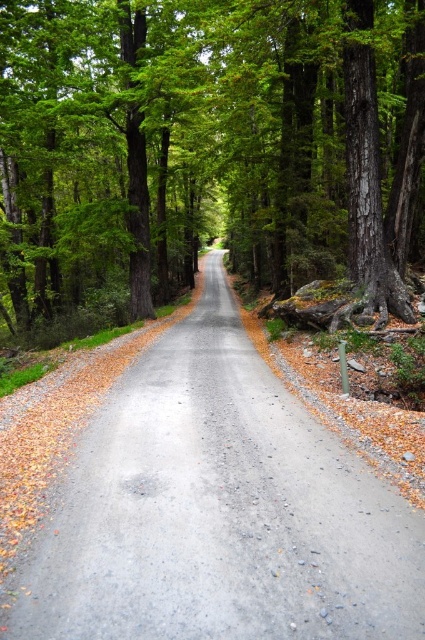
Is brown textured tree at center smaller than gray asphalt road at center?

Actually, brown textured tree at center might be larger than gray asphalt road at center.

Is point (78, 148) behind point (192, 531)?

Yes, it is behind point (192, 531).

Does point (260, 49) lie in front of point (163, 396)?

That is False.

Where is `brown textured tree at center`? Image resolution: width=425 pixels, height=640 pixels. brown textured tree at center is located at coordinates tap(207, 150).